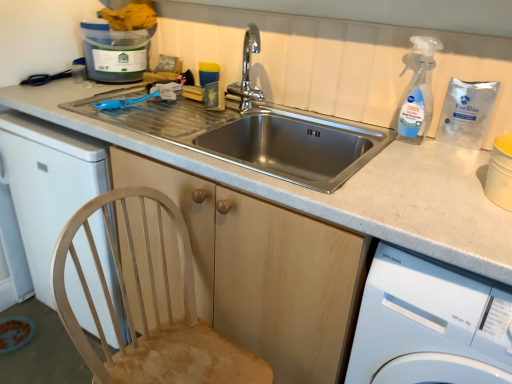
Question: From a real-world perspective, does natural wood chair at lower left sit lower than white glossy washing machine at lower right?

Choices:
 (A) no
 (B) yes

Answer: (B)

Question: Is natural wood chair at lower left turned away from white glossy washing machine at lower right?

Choices:
 (A) no
 (B) yes

Answer: (A)

Question: Is there a large distance between natural wood chair at lower left and white glossy washing machine at lower right?

Choices:
 (A) yes
 (B) no

Answer: (B)

Question: From the image's perspective, is natural wood chair at lower left located beneath white glossy washing machine at lower right?

Choices:
 (A) no
 (B) yes

Answer: (B)

Question: Is natural wood chair at lower left next to white glossy washing machine at lower right and touching it?

Choices:
 (A) no
 (B) yes

Answer: (A)

Question: Is stainless steel sink at center taller or shorter than blue plastic container at upper left?

Choices:
 (A) tall
 (B) short

Answer: (B)

Question: From a real-world perspective, is stainless steel sink at center physically located above or below blue plastic container at upper left?

Choices:
 (A) above
 (B) below

Answer: (B)

Question: Is stainless steel sink at center inside the boundaries of blue plastic container at upper left, or outside?

Choices:
 (A) outside
 (B) inside

Answer: (A)

Question: Is stainless steel sink at center in front of or behind blue plastic container at upper left in the image?

Choices:
 (A) front
 (B) behind

Answer: (A)

Question: Is stainless steel sink at center situated inside natural wood chair at lower left or outside?

Choices:
 (A) outside
 (B) inside

Answer: (A)

Question: Considering the relative positions of stainless steel sink at center and natural wood chair at lower left in the image provided, is stainless steel sink at center to the left or to the right of natural wood chair at lower left?

Choices:
 (A) right
 (B) left

Answer: (A)

Question: Considering their positions, is stainless steel sink at center located in front of or behind natural wood chair at lower left?

Choices:
 (A) behind
 (B) front

Answer: (A)

Question: Is stainless steel sink at center bigger or smaller than natural wood chair at lower left?

Choices:
 (A) big
 (B) small

Answer: (B)

Question: Is white glossy washing machine at lower right bigger or smaller than blue plastic container at upper left?

Choices:
 (A) small
 (B) big

Answer: (B)

Question: In terms of height, does white glossy washing machine at lower right look taller or shorter compared to blue plastic container at upper left?

Choices:
 (A) short
 (B) tall

Answer: (B)